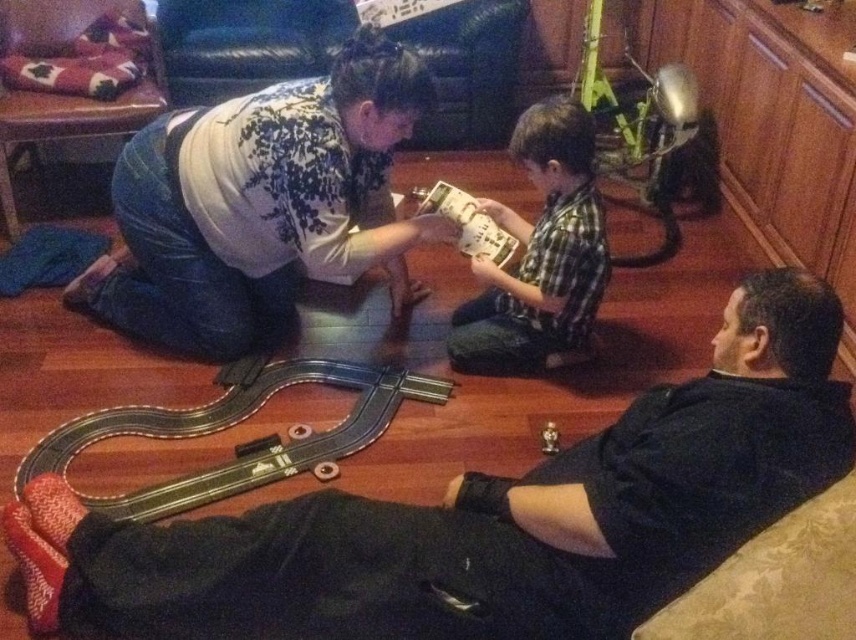
Is black matte couch at lower right bigger than dark gray pants at center?

Indeed, black matte couch at lower right has a larger size compared to dark gray pants at center.

Where is `black matte couch at lower right`? The height and width of the screenshot is (640, 856). black matte couch at lower right is located at coordinates (483, 516).

Which is more to the right, dark gray pants at center or green plaid shirt at center?

green plaid shirt at center is more to the right.

You are a GUI agent. You are given a task and a screenshot of the screen. Output one action in this format:
    pyautogui.click(x=<x>, y=<y>)
    Task: Click on the dark gray pants at center
    Image resolution: width=856 pixels, height=640 pixels.
    Given the screenshot: What is the action you would take?
    pyautogui.click(x=260, y=204)

The image size is (856, 640). I want to click on dark gray pants at center, so click(260, 204).

Who is positioned more to the right, black matte couch at lower right or green plaid shirt at center?

From the viewer's perspective, green plaid shirt at center appears more on the right side.

Does point (761, 310) lie in front of point (526, 115)?

Yes, it is in front of point (526, 115).

This screenshot has width=856, height=640. What do you see at coordinates (483, 516) in the screenshot?
I see `black matte couch at lower right` at bounding box center [483, 516].

You are a GUI agent. You are given a task and a screenshot of the screen. Output one action in this format:
    pyautogui.click(x=<x>, y=<y>)
    Task: Click on the black matte couch at lower right
    The width and height of the screenshot is (856, 640).
    Given the screenshot: What is the action you would take?
    pyautogui.click(x=483, y=516)